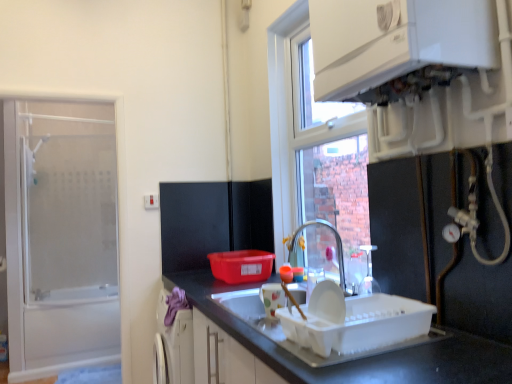
Question: From a real-world perspective, is glossy metallic tap at center located beneath white glossy countertop at lower center?

Choices:
 (A) yes
 (B) no

Answer: (B)

Question: Is glossy metallic tap at center at the right side of white glossy countertop at lower center?

Choices:
 (A) no
 (B) yes

Answer: (B)

Question: From the image's perspective, is glossy metallic tap at center on top of white glossy countertop at lower center?

Choices:
 (A) yes
 (B) no

Answer: (A)

Question: Can you confirm if glossy metallic tap at center is wider than white glossy countertop at lower center?

Choices:
 (A) yes
 (B) no

Answer: (B)

Question: Is glossy metallic tap at center positioned beyond the bounds of white glossy countertop at lower center?

Choices:
 (A) yes
 (B) no

Answer: (A)

Question: Can you confirm if glossy metallic tap at center is bigger than white glossy countertop at lower center?

Choices:
 (A) yes
 (B) no

Answer: (B)

Question: From a real-world perspective, is transparent glass shower door at left over white glossy countertop at lower center?

Choices:
 (A) no
 (B) yes

Answer: (B)

Question: Considering the relative sizes of transparent glass shower door at left and white glossy countertop at lower center in the image provided, is transparent glass shower door at left smaller than white glossy countertop at lower center?

Choices:
 (A) yes
 (B) no

Answer: (A)

Question: Is transparent glass shower door at left positioned far away from white glossy countertop at lower center?

Choices:
 (A) no
 (B) yes

Answer: (B)

Question: Is transparent glass shower door at left closer to the viewer compared to white glossy countertop at lower center?

Choices:
 (A) yes
 (B) no

Answer: (B)

Question: From the image's perspective, would you say transparent glass shower door at left is positioned over white glossy countertop at lower center?

Choices:
 (A) yes
 (B) no

Answer: (A)

Question: From the image's perspective, is transparent glass shower door at left under white glossy countertop at lower center?

Choices:
 (A) yes
 (B) no

Answer: (B)

Question: Can you confirm if white glossy boiler at upper right is positioned to the left of transparent glass shower door at left?

Choices:
 (A) yes
 (B) no

Answer: (B)